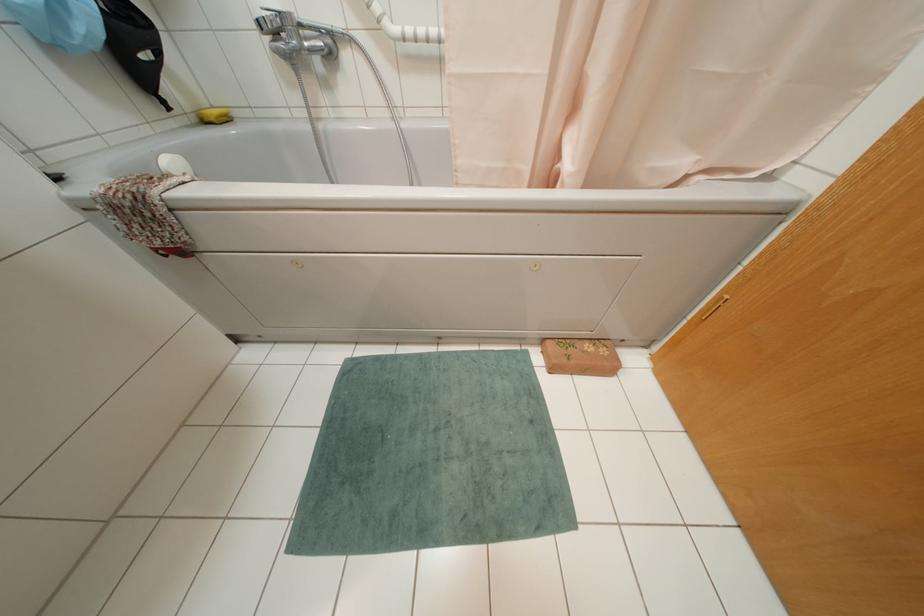
Where is `small floral block`? small floral block is located at coordinates (579, 357).